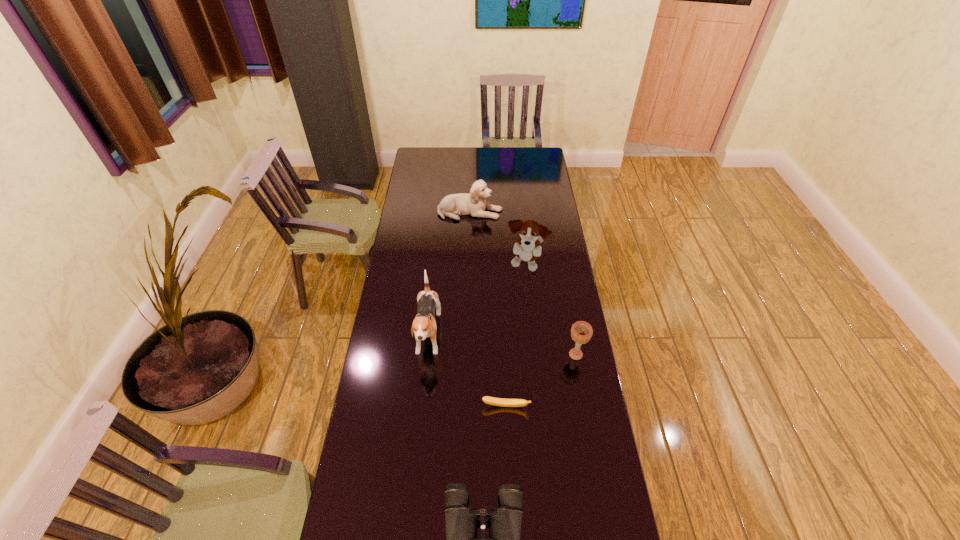
This screenshot has height=540, width=960. Find the location of `the second farthest object`. the second farthest object is located at coordinates point(527,248).

Where is `the nearest puppy`? the nearest puppy is located at coordinates [x=424, y=325].

Identify the location of the farthest puppy. [474, 203].

I want to click on the farthest object, so click(x=474, y=203).

What are the coordinates of `chalice` in the screenshot? It's located at (581, 332).

Identify the location of the fifth farthest object. Image resolution: width=960 pixels, height=540 pixels. (502, 402).

Image resolution: width=960 pixels, height=540 pixels. Identify the location of banana. (502, 402).

Locate an element on the screen. This screenshot has width=960, height=540. blank space located on the face of the second farthest object is located at coordinates (532, 332).

Find the location of a particular element. Image resolution: width=960 pixels, height=540 pixels. free space located at the face of the nearest puppy is located at coordinates (417, 455).

Locate an element on the screen. This screenshot has height=540, width=960. free spot located 0.290m on the front-facing side of the farthest puppy is located at coordinates (559, 212).